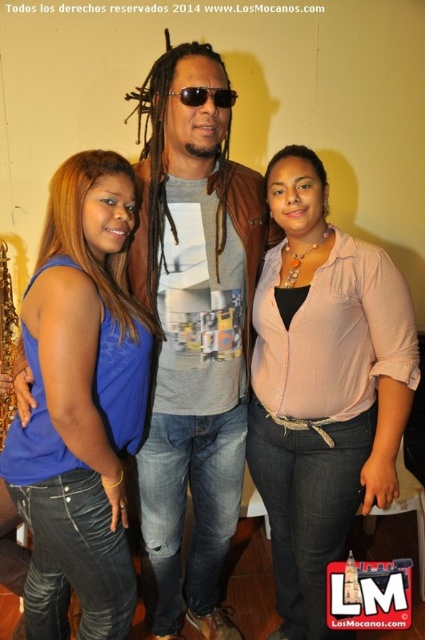
Question: Where is pink satin blouse at center located in relation to blue denim jeans at center in the image?

Choices:
 (A) above
 (B) below

Answer: (B)

Question: Which of the following is the farthest from the observer?

Choices:
 (A) (367, 493)
 (B) (144, 221)
 (C) (17, 464)

Answer: (B)

Question: Is pink satin blouse at center behind sunglasses at center?

Choices:
 (A) yes
 (B) no

Answer: (A)

Question: Among these points, which one is farthest from the camera?

Choices:
 (A) (241, 202)
 (B) (234, 104)

Answer: (B)

Question: Which of the following is the farthest from the observer?

Choices:
 (A) pink satin blouse at center
 (B) blue denim jeans at center

Answer: (A)

Question: Does pink satin blouse at center appear under brown leather jacket at center?

Choices:
 (A) no
 (B) yes

Answer: (B)